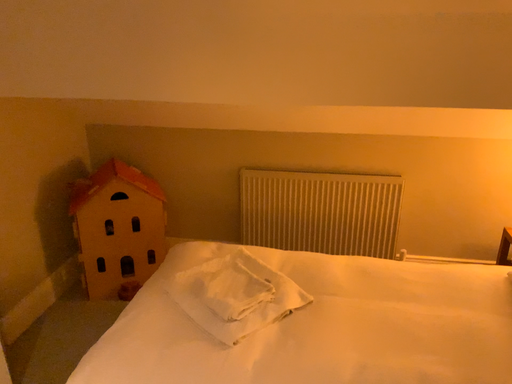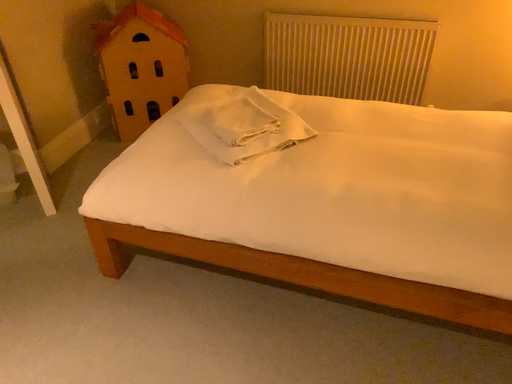
Question: How did the camera likely rotate when shooting the video?

Choices:
 (A) rotated upward
 (B) rotated downward

Answer: (B)